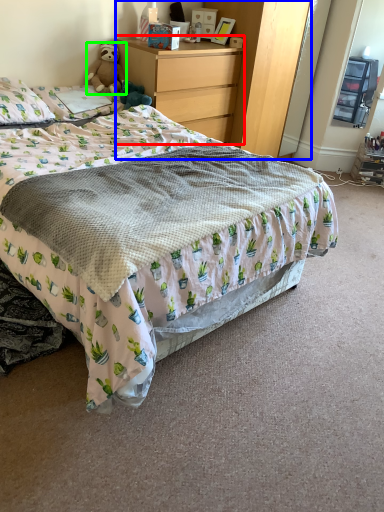
Question: Estimate the real-world distances between objects in this image. Which object is farther from chest of drawers (highlighted by a red box), dresser (highlighted by a blue box) or teddy bear (highlighted by a green box)?

Choices:
 (A) dresser
 (B) teddy bear

Answer: (B)